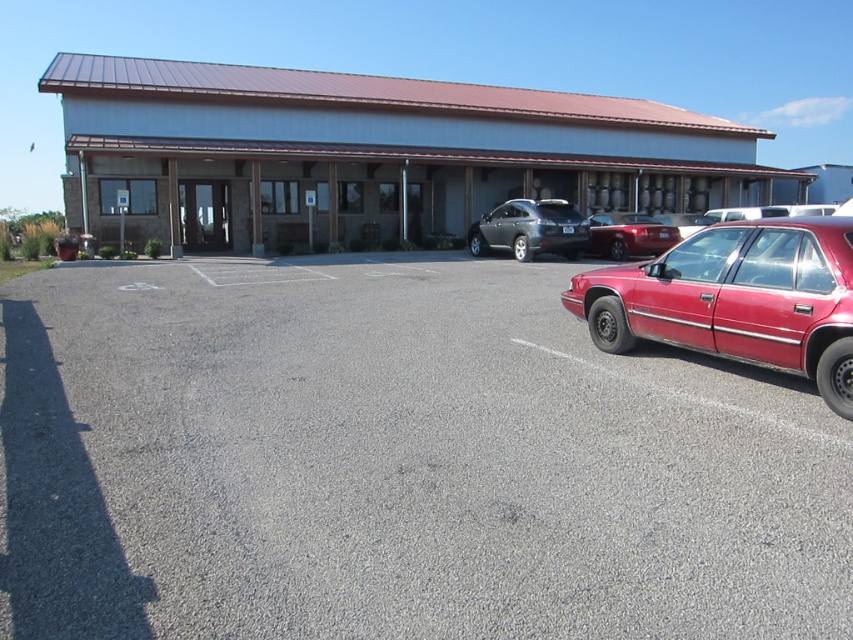
Question: Considering the relative positions of gray asphalt parking lot at lower right and matte red sedan at center in the image provided, where is gray asphalt parking lot at lower right located with respect to matte red sedan at center?

Choices:
 (A) below
 (B) above

Answer: (A)

Question: Which of the following is the closest to the observer?

Choices:
 (A) pos(762,317)
 (B) pos(502,228)
 (C) pos(631,250)
 (D) pos(712,545)

Answer: (D)

Question: Which point appears farthest from the camera in this image?

Choices:
 (A) (750, 246)
 (B) (488, 243)
 (C) (328, 540)
 (D) (604, 252)

Answer: (B)

Question: Can you confirm if gray asphalt parking lot at lower right is positioned above matte red sedan at center?

Choices:
 (A) yes
 (B) no

Answer: (B)

Question: Considering the relative positions of gray asphalt parking lot at lower right and matte red sedan at center in the image provided, where is gray asphalt parking lot at lower right located with respect to matte red sedan at center?

Choices:
 (A) below
 (B) above

Answer: (A)

Question: Which object is closer to the camera taking this photo?

Choices:
 (A) gray asphalt parking lot at lower right
 (B) glossy red sedan at right
 (C) satin black sedan at center
 (D) matte red sedan at center

Answer: (A)